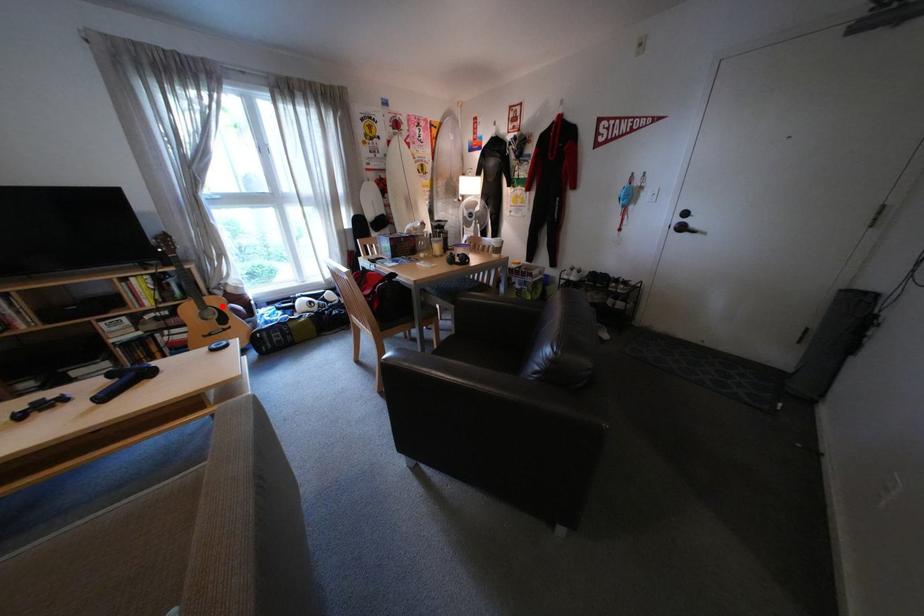
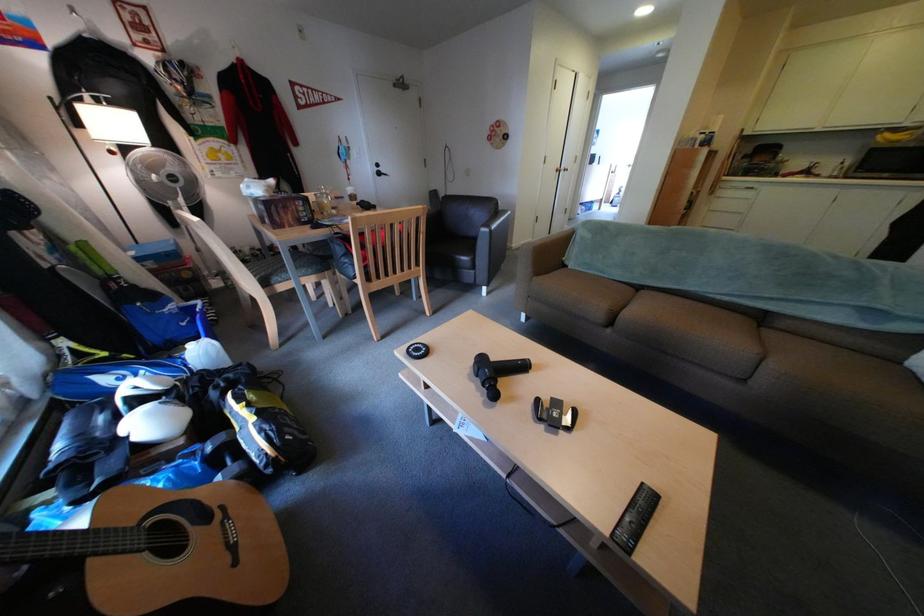
Question: A red point is marked in image1. In image2, is the corresponding 3D point closer to the camera or farther? Reply with the corresponding letter.

Choices:
 (A) The corresponding 3D point is closer.
 (B) The corresponding 3D point is farther.

Answer: (B)